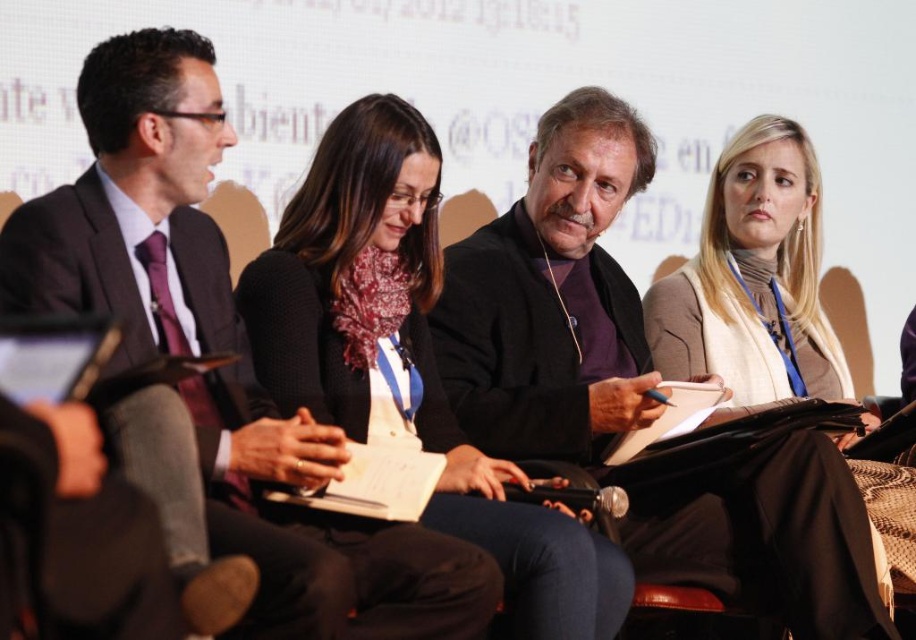
Who is positioned more to the right, matte black suit at left or dark brown leather jacket at center?

From the viewer's perspective, dark brown leather jacket at center appears more on the right side.

Does matte black suit at left have a greater width compared to dark brown leather jacket at center?

Yes, matte black suit at left is wider than dark brown leather jacket at center.

Between point (387, 554) and point (747, 516), which one is positioned behind?

The point (747, 516) is behind.

At what (x,y) coordinates should I click in order to perform the action: click on matte black suit at left. Please return your answer as a coordinate pair (x, y). This screenshot has height=640, width=916. Looking at the image, I should click on (220, 349).

Is black matte scarf at center positioned in front of blonde hair scarf at upper right?

Yes.

Describe the element at coordinates (409, 360) in the screenshot. I see `black matte scarf at center` at that location.

Where is `black matte scarf at center`? black matte scarf at center is located at coordinates (409, 360).

Is dark brown leather jacket at center smaller than blonde hair scarf at upper right?

Yes.

Which is in front, point (589, 264) or point (760, 330)?

Positioned in front is point (589, 264).

The width and height of the screenshot is (916, 640). I want to click on dark brown leather jacket at center, so click(x=552, y=301).